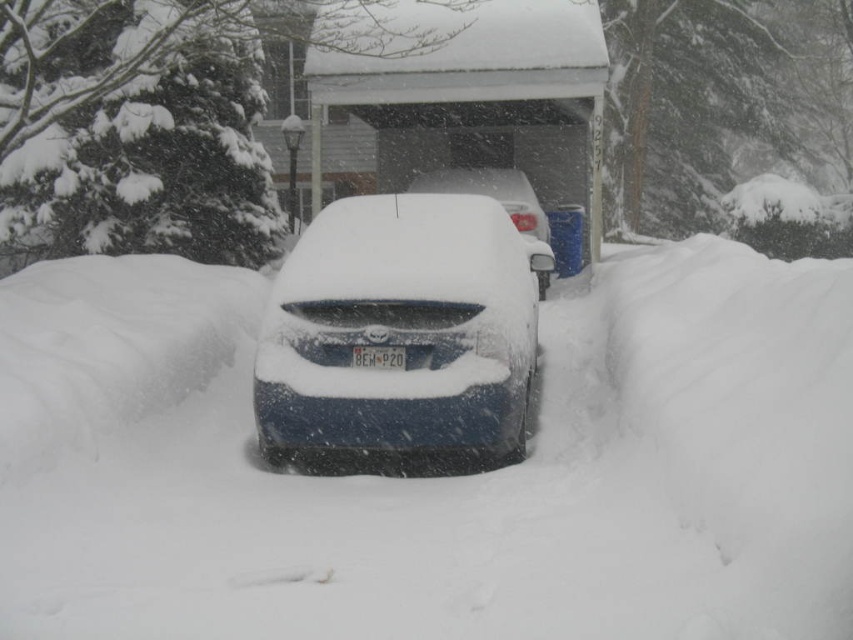
Is white fluffy snow at center to the left of white plastic license plate at center from the viewer's perspective?

Correct, you'll find white fluffy snow at center to the left of white plastic license plate at center.

What do you see at coordinates (488, 490) in the screenshot? I see `white fluffy snow at center` at bounding box center [488, 490].

You are a GUI agent. You are given a task and a screenshot of the screen. Output one action in this format:
    pyautogui.click(x=<x>, y=<y>)
    Task: Click on the white fluffy snow at center
    Image resolution: width=853 pixels, height=640 pixels.
    Given the screenshot: What is the action you would take?
    pyautogui.click(x=488, y=490)

Does white fluffy snow at center appear on the left side of sleek blue car at center?

Correct, you'll find white fluffy snow at center to the left of sleek blue car at center.

Locate an element on the screen. The image size is (853, 640). white fluffy snow at center is located at coordinates (488, 490).

This screenshot has width=853, height=640. Describe the element at coordinates (488, 490) in the screenshot. I see `white fluffy snow at center` at that location.

You are a GUI agent. You are given a task and a screenshot of the screen. Output one action in this format:
    pyautogui.click(x=<x>, y=<y>)
    Task: Click on the white fluffy snow at center
    This screenshot has height=640, width=853.
    Given the screenshot: What is the action you would take?
    pyautogui.click(x=488, y=490)

Does sleek blue sedan at center have a smaller size compared to sleek blue car at center?

Yes, sleek blue sedan at center is smaller than sleek blue car at center.

Measure the distance between sleek blue sedan at center and camera.

A distance of 19.50 feet exists between sleek blue sedan at center and camera.

You are a GUI agent. You are given a task and a screenshot of the screen. Output one action in this format:
    pyautogui.click(x=<x>, y=<y>)
    Task: Click on the sleek blue sedan at center
    The image size is (853, 640).
    Given the screenshot: What is the action you would take?
    pyautogui.click(x=401, y=330)